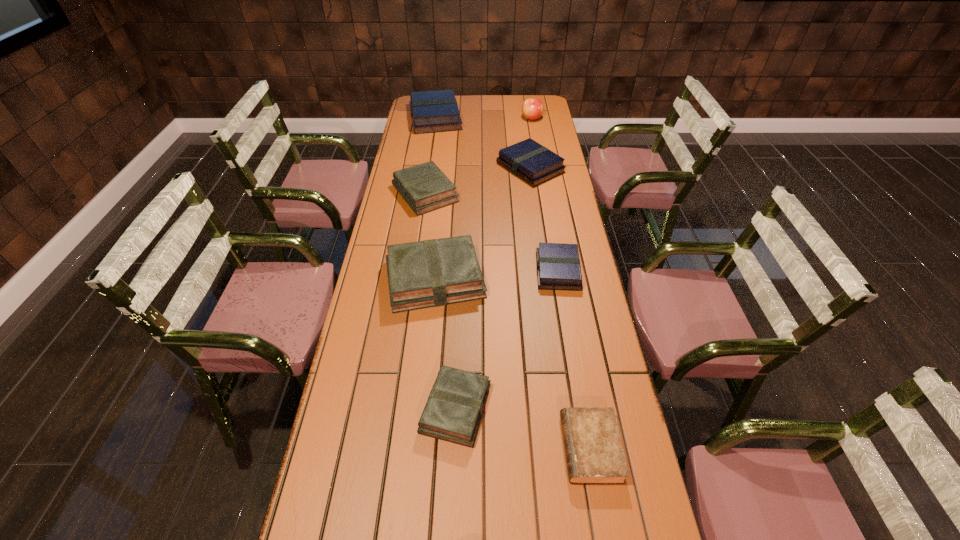
At what (x,y) coordinates should I click in order to perform the action: click on apple that is at the far edge. Please return your answer as a coordinate pair (x, y). This screenshot has width=960, height=540. Looking at the image, I should click on (532, 108).

In order to click on book present at the far edge in this screenshot , I will do `click(431, 111)`.

Image resolution: width=960 pixels, height=540 pixels. Identify the location of apple present at the right edge. (532, 108).

The height and width of the screenshot is (540, 960). I want to click on diary that is at the right edge, so click(x=594, y=454).

At what (x,y) coordinates should I click in order to perform the action: click on object that is positioned at the far left corner. Please return your answer as a coordinate pair (x, y). This screenshot has width=960, height=540. Looking at the image, I should click on (431, 111).

Where is `object that is at the far right corner`? The image size is (960, 540). object that is at the far right corner is located at coordinates (532, 108).

Locate an element on the screen. The height and width of the screenshot is (540, 960). free space at the far edge is located at coordinates (507, 98).

The height and width of the screenshot is (540, 960). I want to click on free space at the left edge of the desktop, so click(373, 299).

This screenshot has width=960, height=540. I want to click on vacant space at the right edge of the desktop, so click(x=544, y=138).

Find the location of a particular element. This screenshot has width=960, height=540. vacant area that lies between the second nearest greenish book and the smallest greenish book is located at coordinates (445, 343).